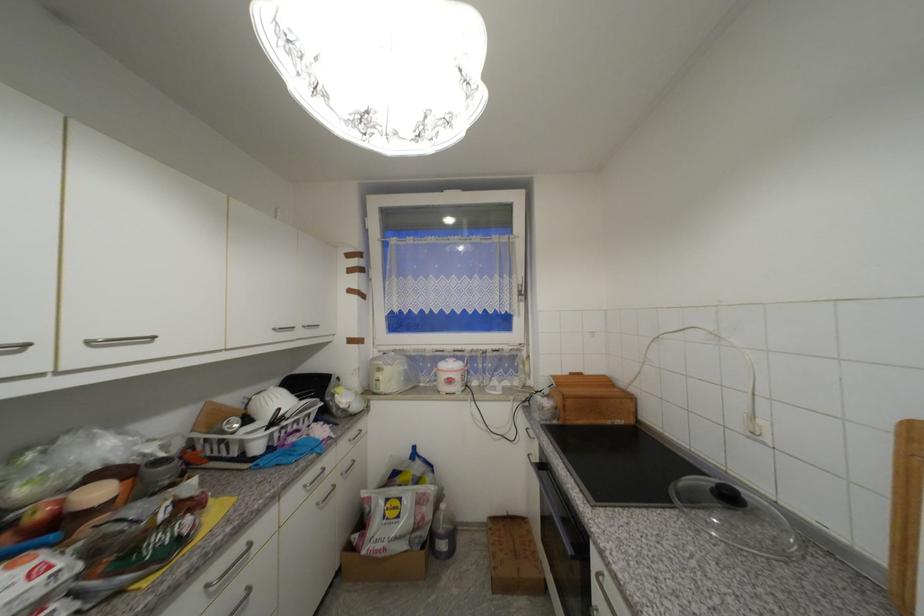
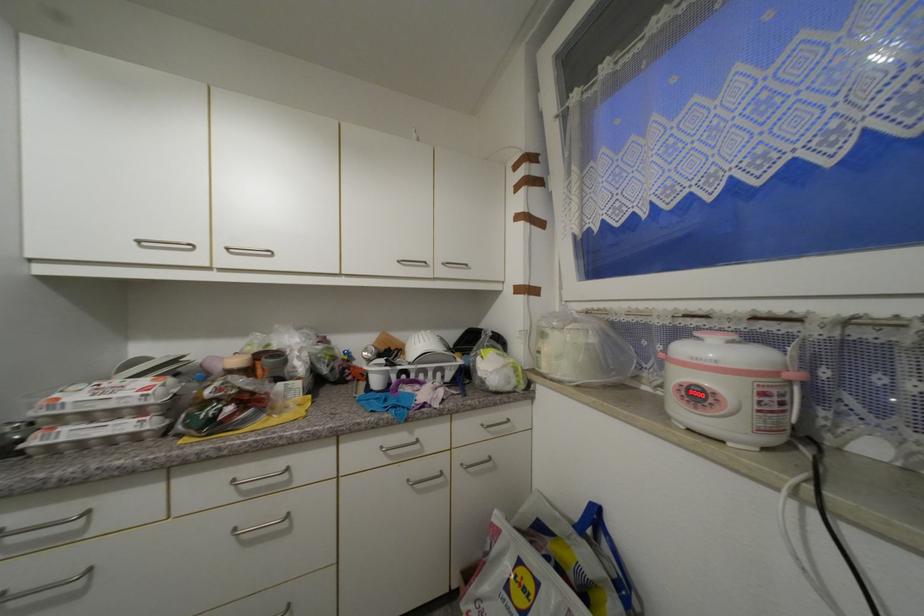
Find the pixel in the second image that matches point 438,468 in the first image.

(636, 588)